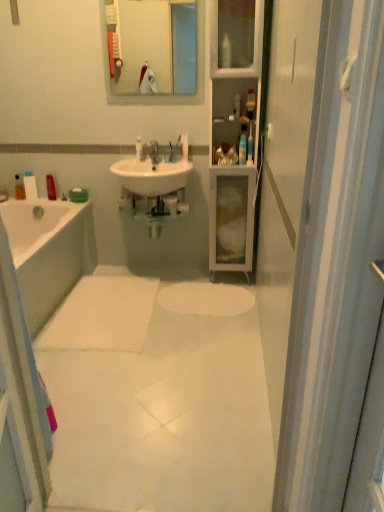
Find the location of `free spot in front of white soft bath mat at center`. free spot in front of white soft bath mat at center is located at coordinates (125, 387).